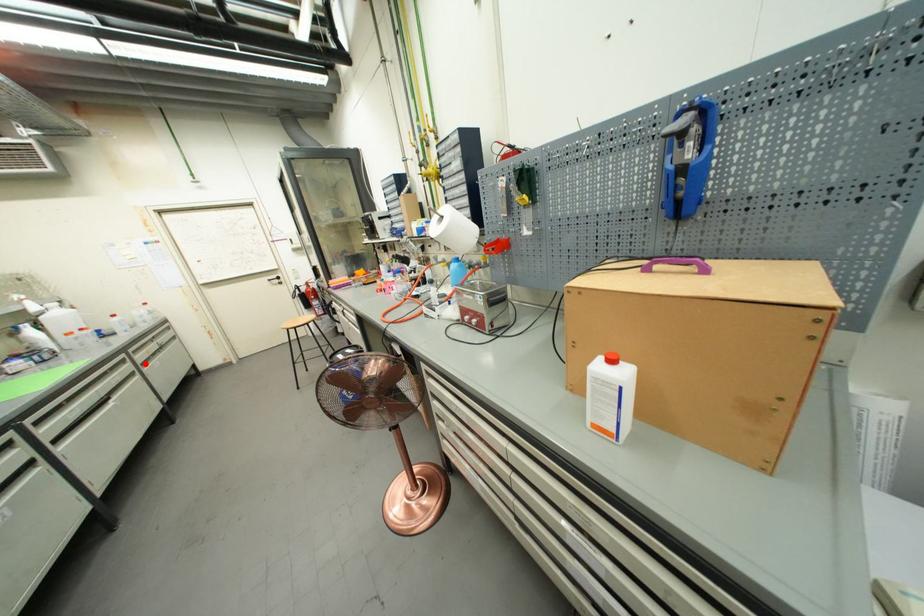
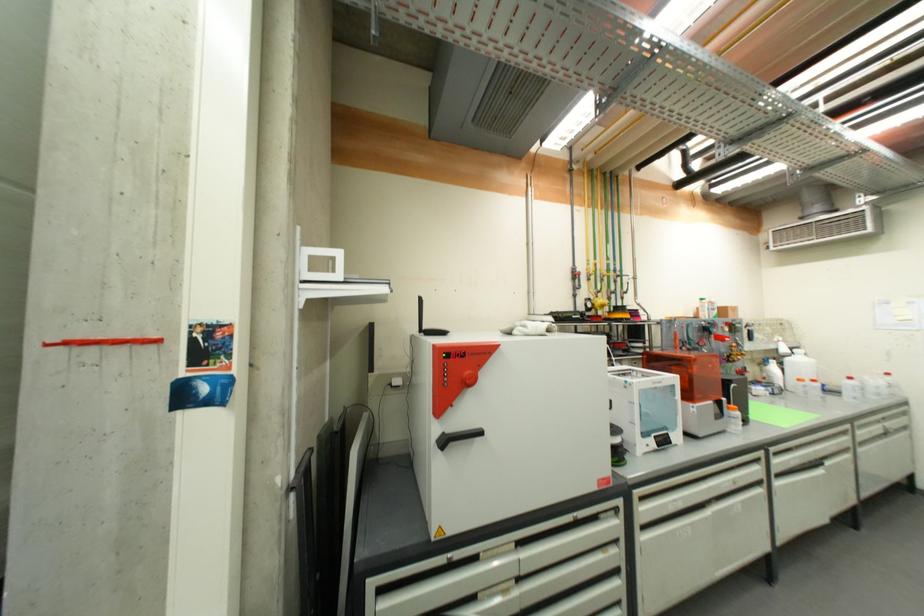
Question: A red point is marked in image1. In image2, is the corresponding 3D point closer to the camera or farther? Reply with the corresponding letter.

Choices:
 (A) The corresponding 3D point is closer.
 (B) The corresponding 3D point is farther.

Answer: (A)